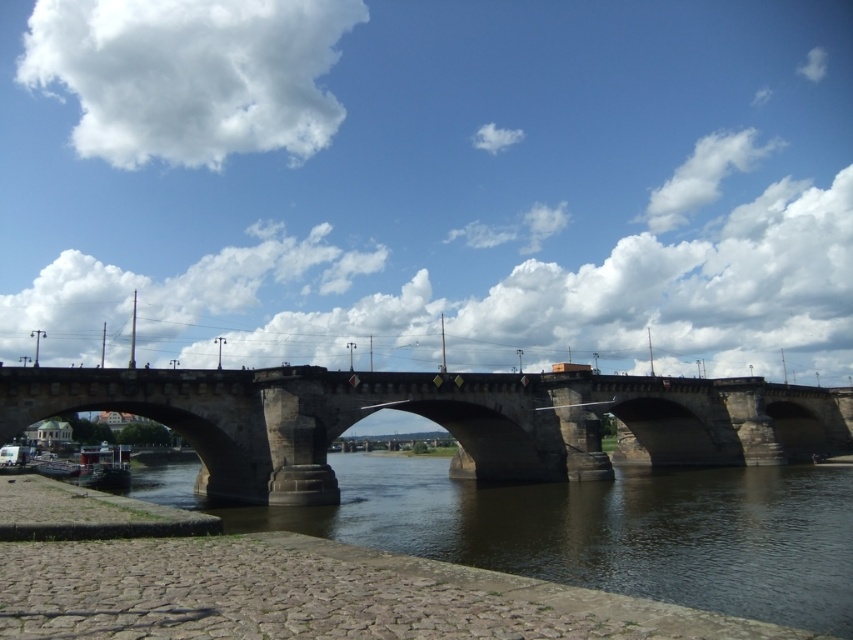
Looking at this image, is white fluffy cloud at upper right smaller than white fluffy cloud at upper center?

No, white fluffy cloud at upper right is not smaller than white fluffy cloud at upper center.

Is white fluffy cloud at upper right below white fluffy cloud at upper center?

Correct, white fluffy cloud at upper right is located below white fluffy cloud at upper center.

Identify the location of white fluffy cloud at upper right. This screenshot has width=853, height=640. pyautogui.click(x=701, y=177).

Is point (363, 384) more distant than point (494, 125)?

That is False.

Is stone bridge at center closer to the viewer compared to white fluffy cloud at upper center?

Yes, it is.

Is point (358, 388) positioned before point (491, 148)?

Yes, it is.

Find the location of a particular element. The image size is (853, 640). stone bridge at center is located at coordinates (440, 420).

Who is positioned more to the right, stone bridge at center or white fluffy cloud at upper left?

From the viewer's perspective, stone bridge at center appears more on the right side.

Is stone bridge at center taller than white fluffy cloud at upper left?

No.

The height and width of the screenshot is (640, 853). Find the location of `stone bridge at center`. stone bridge at center is located at coordinates (440, 420).

The width and height of the screenshot is (853, 640). I want to click on stone bridge at center, so click(x=440, y=420).